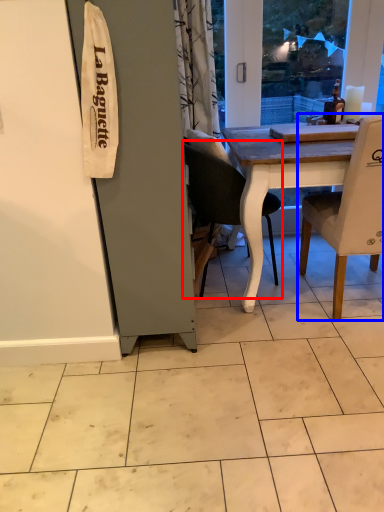
Question: Which of the following is the farthest to the observer, chair (highlighted by a red box) or chair (highlighted by a blue box)?

Choices:
 (A) chair
 (B) chair

Answer: (A)